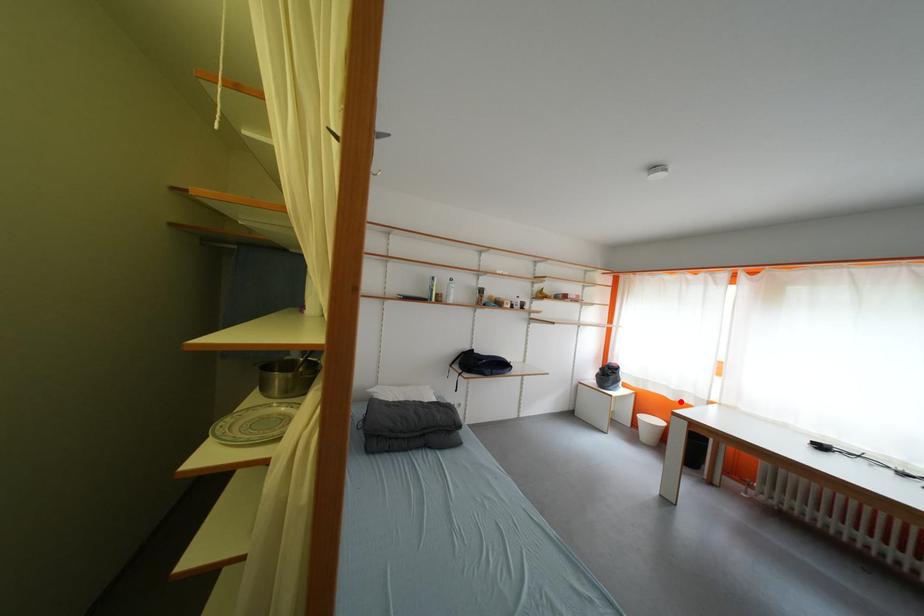
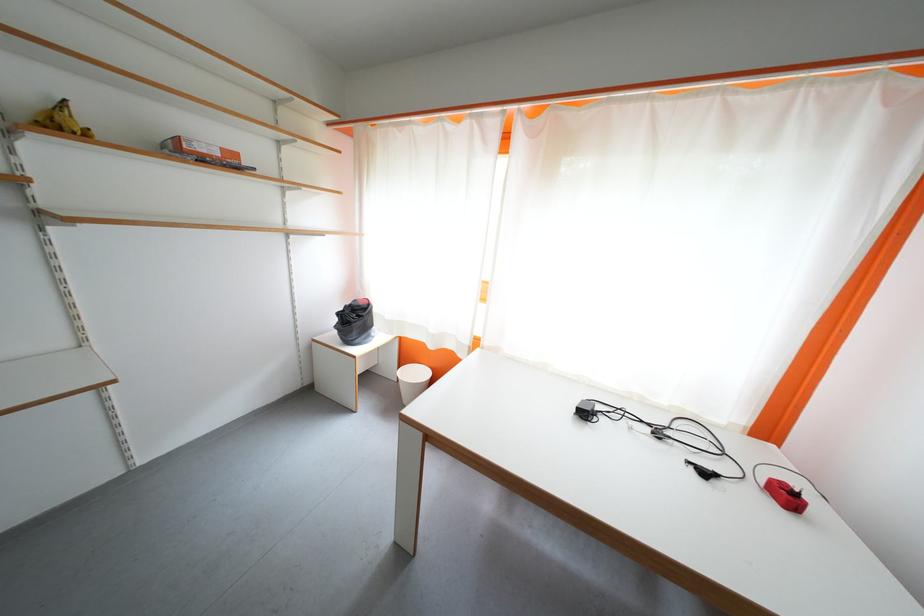
Locate, in the second image, the point that corresponds to the highlighted location in the first image.

(440, 350)